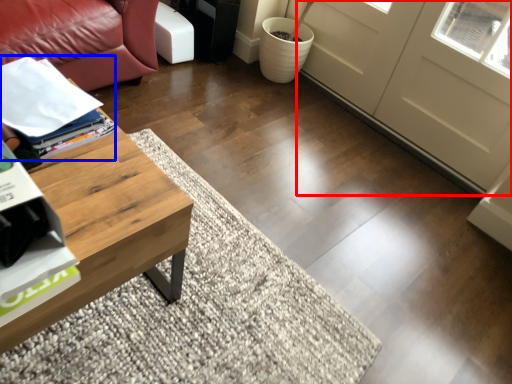
Question: Which object is further to the camera taking this photo, screen door (highlighted by a red box) or magazine (highlighted by a blue box)?

Choices:
 (A) screen door
 (B) magazine

Answer: (A)